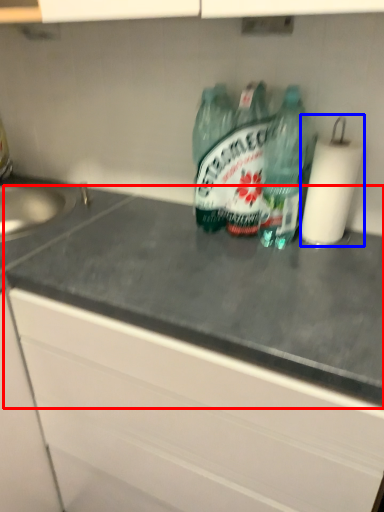
Question: Among these objects, which one is nearest to the camera, counter top (highlighted by a red box) or paper towel (highlighted by a blue box)?

Choices:
 (A) counter top
 (B) paper towel

Answer: (A)